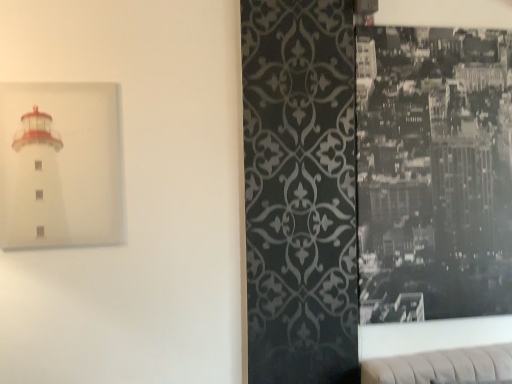
Where is `black glossy photo at right, arranged as the first picture frame when viewed from the back`? The width and height of the screenshot is (512, 384). black glossy photo at right, arranged as the first picture frame when viewed from the back is located at coordinates (434, 172).

What do you see at coordinates (434, 172) in the screenshot?
I see `black glossy photo at right, which is counted as the 1th picture frame, starting from the right` at bounding box center [434, 172].

I want to click on white matte lighthouse at left, the second picture frame in the right-to-left sequence, so click(60, 165).

What do you see at coordinates (60, 165) in the screenshot? This screenshot has height=384, width=512. I see `white matte lighthouse at left, which ranks as the 1th picture frame in left-to-right order` at bounding box center [60, 165].

Identify the location of black glossy photo at right, arranged as the first picture frame when viewed from the back. (434, 172).

Considering the positions of objects black glossy photo at right, which is counted as the 1th picture frame, starting from the right, and white matte lighthouse at left, the second picture frame in the right-to-left sequence, in the image provided, who is more to the right, black glossy photo at right, which is counted as the 1th picture frame, starting from the right, or white matte lighthouse at left, the second picture frame in the right-to-left sequence,?

black glossy photo at right, which is counted as the 1th picture frame, starting from the right, is more to the right.

Between black glossy photo at right, acting as the second picture frame starting from the left, and white matte lighthouse at left, which ranks as the 1th picture frame in left-to-right order, which one is positioned behind?

black glossy photo at right, acting as the second picture frame starting from the left.

Is point (499, 278) closer to viewer compared to point (26, 112)?

No.

From the image's perspective, is black glossy photo at right, the second picture frame viewed from the front, on white matte lighthouse at left, which ranks as the 1th picture frame in left-to-right order?

No, from the image's perspective, black glossy photo at right, the second picture frame viewed from the front, is not above white matte lighthouse at left, which ranks as the 1th picture frame in left-to-right order.

From a real-world perspective, is black glossy photo at right, which is counted as the 1th picture frame, starting from the right, physically below white matte lighthouse at left, which ranks as the 1th picture frame in left-to-right order?

Yes, from a real-world perspective, black glossy photo at right, which is counted as the 1th picture frame, starting from the right, is under white matte lighthouse at left, which ranks as the 1th picture frame in left-to-right order.

From the picture: Considering the relative sizes of black glossy photo at right, arranged as the first picture frame when viewed from the back, and white matte lighthouse at left, which ranks as the 1th picture frame in left-to-right order, in the image provided, is black glossy photo at right, arranged as the first picture frame when viewed from the back, thinner than white matte lighthouse at left, which ranks as the 1th picture frame in left-to-right order,?

No, black glossy photo at right, arranged as the first picture frame when viewed from the back, is not thinner than white matte lighthouse at left, which ranks as the 1th picture frame in left-to-right order.

Does black glossy photo at right, arranged as the first picture frame when viewed from the back, have a lesser height compared to white matte lighthouse at left, which ranks as the 1th picture frame in left-to-right order?

In fact, black glossy photo at right, arranged as the first picture frame when viewed from the back, may be taller than white matte lighthouse at left, which ranks as the 1th picture frame in left-to-right order.

Considering the relative sizes of black glossy photo at right, acting as the second picture frame starting from the left, and white matte lighthouse at left, the second picture frame in the right-to-left sequence, in the image provided, is black glossy photo at right, acting as the second picture frame starting from the left, bigger than white matte lighthouse at left, the second picture frame in the right-to-left sequence,?

Correct, black glossy photo at right, acting as the second picture frame starting from the left, is larger in size than white matte lighthouse at left, the second picture frame in the right-to-left sequence.

Is black glossy photo at right, the second picture frame viewed from the front, inside or outside of white matte lighthouse at left, placed as the second picture frame when sorted from back to front?

black glossy photo at right, the second picture frame viewed from the front, cannot be found inside white matte lighthouse at left, placed as the second picture frame when sorted from back to front.

Is black glossy photo at right, which is counted as the 1th picture frame, starting from the right, touching white matte lighthouse at left, placed as the second picture frame when sorted from back to front?

There is a gap between black glossy photo at right, which is counted as the 1th picture frame, starting from the right, and white matte lighthouse at left, placed as the second picture frame when sorted from back to front.

Could you tell me if black glossy photo at right, which is counted as the 1th picture frame, starting from the right, is turned towards white matte lighthouse at left, which ranks as the 1th picture frame in left-to-right order?

No, black glossy photo at right, which is counted as the 1th picture frame, starting from the right, is not turned towards white matte lighthouse at left, which ranks as the 1th picture frame in left-to-right order.

How many degrees apart are the facing directions of black glossy photo at right, which is counted as the 1th picture frame, starting from the right, and white matte lighthouse at left, placed as the second picture frame when sorted from back to front?

0.0689 degrees separate the facing orientations of black glossy photo at right, which is counted as the 1th picture frame, starting from the right, and white matte lighthouse at left, placed as the second picture frame when sorted from back to front.

This screenshot has height=384, width=512. What are the coordinates of `picture frame above the black glossy photo at right, arranged as the first picture frame when viewed from the back (from a real-world perspective)` in the screenshot? It's located at (60, 165).

Between white matte lighthouse at left, the 1th picture frame from the front, and black glossy photo at right, the second picture frame viewed from the front, which one appears on the right side from the viewer's perspective?

black glossy photo at right, the second picture frame viewed from the front.

Which object is more forward, white matte lighthouse at left, the 1th picture frame from the front, or black glossy photo at right, acting as the second picture frame starting from the left?

Positioned in front is white matte lighthouse at left, the 1th picture frame from the front.

Which point is more forward, (71, 86) or (391, 117)?

The point (71, 86) is more forward.

Looking at this image, from the image's perspective, which object appears higher, white matte lighthouse at left, the second picture frame in the right-to-left sequence, or black glossy photo at right, acting as the second picture frame starting from the left?

white matte lighthouse at left, the second picture frame in the right-to-left sequence, appears higher in the image.

From a real-world perspective, is white matte lighthouse at left, the second picture frame in the right-to-left sequence, located higher than black glossy photo at right, the second picture frame viewed from the front?

Indeed, from a real-world perspective, white matte lighthouse at left, the second picture frame in the right-to-left sequence, stands above black glossy photo at right, the second picture frame viewed from the front.

Which object is wider, white matte lighthouse at left, the 1th picture frame from the front, or black glossy photo at right, which is counted as the 1th picture frame, starting from the right?

Wider between the two is black glossy photo at right, which is counted as the 1th picture frame, starting from the right.

Between white matte lighthouse at left, the 1th picture frame from the front, and black glossy photo at right, acting as the second picture frame starting from the left, which one has less height?

Standing shorter between the two is white matte lighthouse at left, the 1th picture frame from the front.

Can you confirm if white matte lighthouse at left, which ranks as the 1th picture frame in left-to-right order, is bigger than black glossy photo at right, the second picture frame viewed from the front?

No, white matte lighthouse at left, which ranks as the 1th picture frame in left-to-right order, is not bigger than black glossy photo at right, the second picture frame viewed from the front.

Is white matte lighthouse at left, the second picture frame in the right-to-left sequence, inside the boundaries of black glossy photo at right, the second picture frame viewed from the front, or outside?

white matte lighthouse at left, the second picture frame in the right-to-left sequence, cannot be found inside black glossy photo at right, the second picture frame viewed from the front.

Are white matte lighthouse at left, the second picture frame in the right-to-left sequence, and black glossy photo at right, the second picture frame viewed from the front, located far from each other?

white matte lighthouse at left, the second picture frame in the right-to-left sequence, is positioned a significant distance from black glossy photo at right, the second picture frame viewed from the front.

Is black glossy photo at right, arranged as the first picture frame when viewed from the back, at the back of white matte lighthouse at left, which ranks as the 1th picture frame in left-to-right order?

No, white matte lighthouse at left, which ranks as the 1th picture frame in left-to-right order, is not facing away from black glossy photo at right, arranged as the first picture frame when viewed from the back.

In the scene shown: What's the angular difference between white matte lighthouse at left, the second picture frame in the right-to-left sequence, and black glossy photo at right, arranged as the first picture frame when viewed from the back,'s facing directions?

The angle between the facing direction of white matte lighthouse at left, the second picture frame in the right-to-left sequence, and the facing direction of black glossy photo at right, arranged as the first picture frame when viewed from the back, is 0.0689 degrees.

Where is `picture frame in front of the black glossy photo at right, the second picture frame viewed from the front`? The image size is (512, 384). picture frame in front of the black glossy photo at right, the second picture frame viewed from the front is located at coordinates (60, 165).

Locate an element on the screen. picture frame above the black glossy photo at right, which is counted as the 1th picture frame, starting from the right (from a real-world perspective) is located at coordinates (60, 165).

You are a GUI agent. You are given a task and a screenshot of the screen. Output one action in this format:
    pyautogui.click(x=<x>, y=<y>)
    Task: Click on the picture frame that appears below the white matte lighthouse at left, which ranks as the 1th picture frame in left-to-right order (from a real-world perspective)
    
    Given the screenshot: What is the action you would take?
    pyautogui.click(x=434, y=172)